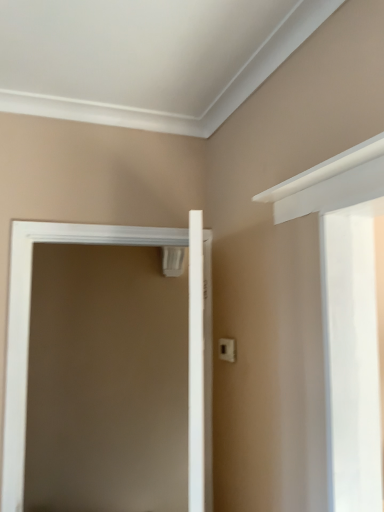
This screenshot has height=512, width=384. What are the coordinates of `matte white screen door at center` in the screenshot? It's located at (29, 332).

Describe the element at coordinates (29, 332) in the screenshot. This screenshot has width=384, height=512. I see `matte white screen door at center` at that location.

Where is `matte white screen door at center`? matte white screen door at center is located at coordinates (29, 332).